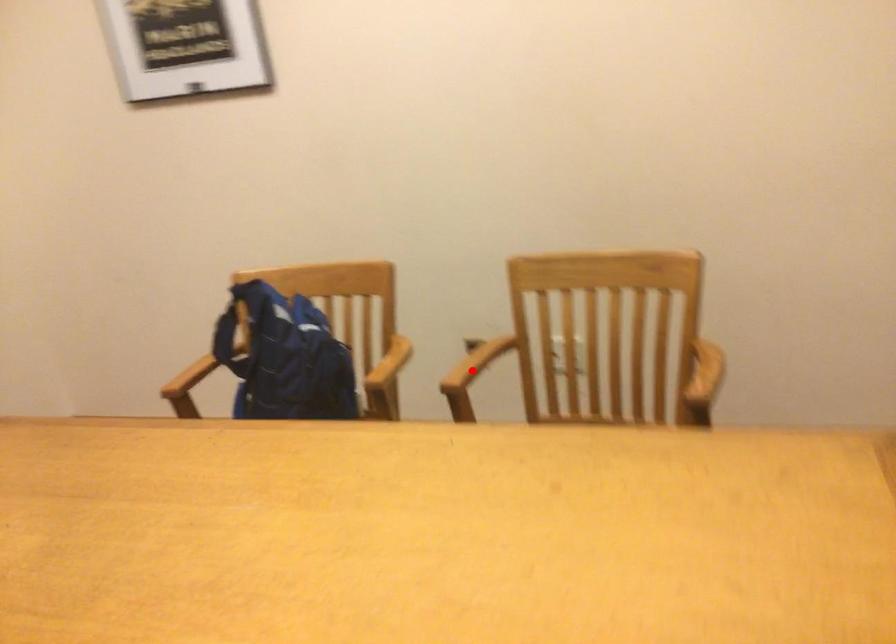
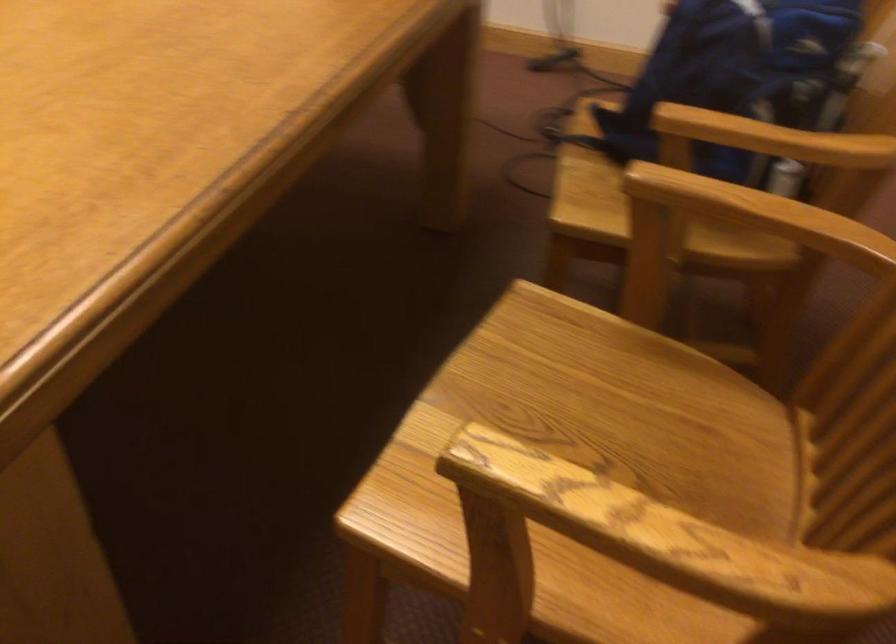
In the second image, find the point that corresponds to the highlighted location in the first image.

(743, 223)